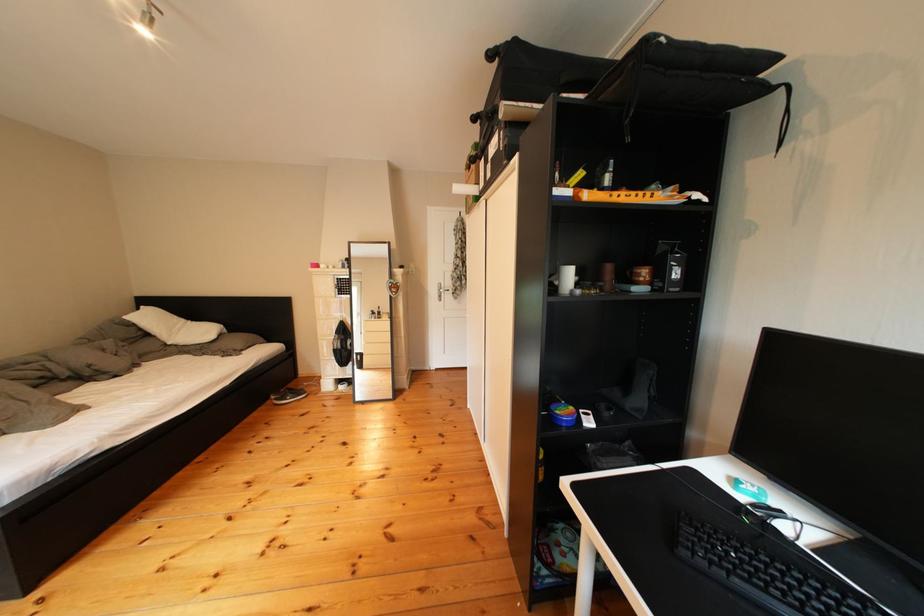
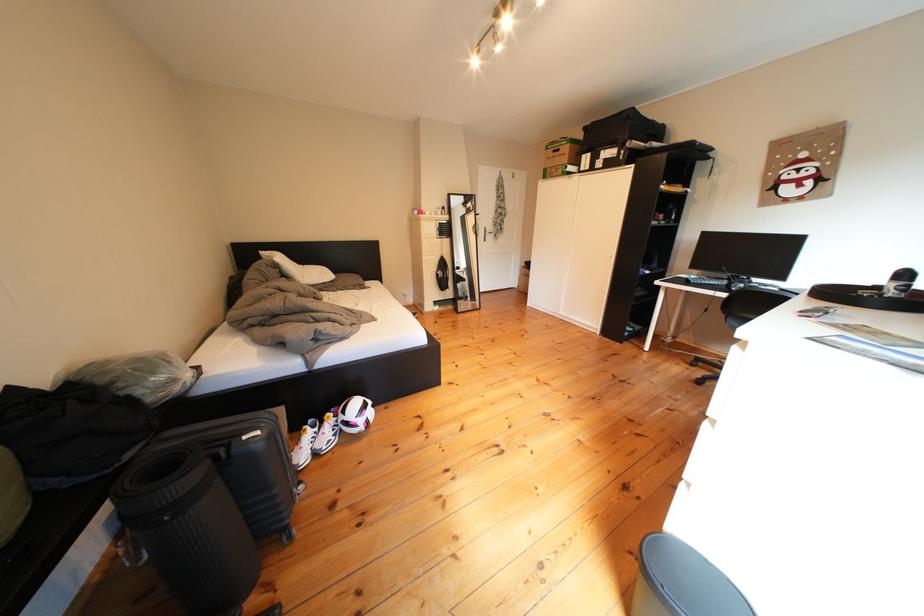
In a continuous first-person perspective shot, in which direction is the camera moving?

The cameraman moved toward left, backward.